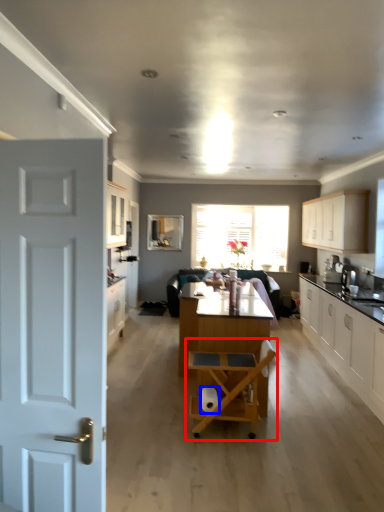
Question: Which point is further to the camera, chair (highlighted by a red box) or toilet paper (highlighted by a blue box)?

Choices:
 (A) chair
 (B) toilet paper

Answer: (B)